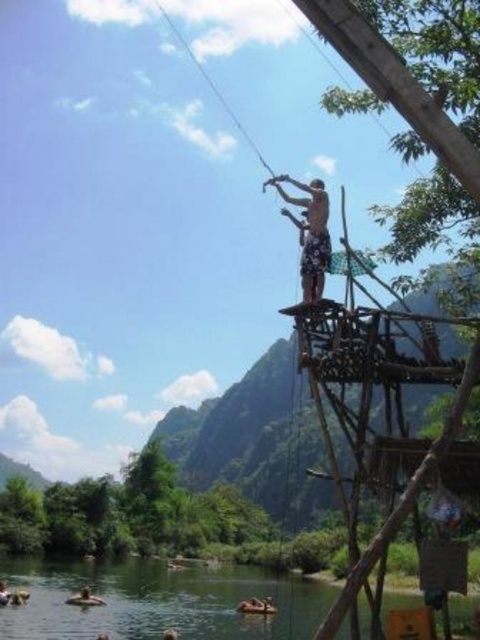
Does tan skin man at center have a lesser width compared to brown wooden raft at lower center?

Yes, tan skin man at center is thinner than brown wooden raft at lower center.

How distant is tan skin man at center from brown wooden raft at lower center?

A distance of 48.22 meters exists between tan skin man at center and brown wooden raft at lower center.

Which is in front, point (301, 227) or point (257, 602)?

Point (301, 227) is in front.

Locate an element on the screen. tan skin man at center is located at coordinates (310, 234).

Which is above, greenish water at lower center or blue sky at upper center?

blue sky at upper center is higher up.

What do you see at coordinates (158, 602) in the screenshot?
I see `greenish water at lower center` at bounding box center [158, 602].

Find the location of `greenish water at lower center`. greenish water at lower center is located at coordinates click(158, 602).

Which is more to the right, greenish water at lower center or brown skin person at lower left?

greenish water at lower center

In the scene shown: Which of these two, greenish water at lower center or brown skin person at lower left, stands taller?

With more height is greenish water at lower center.

Find the location of a particular element. The image size is (480, 640). greenish water at lower center is located at coordinates (158, 602).